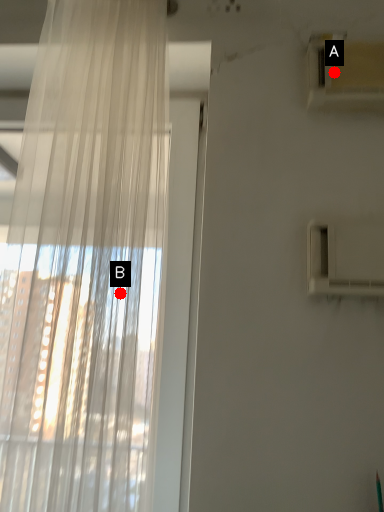
Question: Two points are circled on the image, labeled by A and B beside each circle. Which point is closer to the camera?

Choices:
 (A) A is closer
 (B) B is closer

Answer: (B)